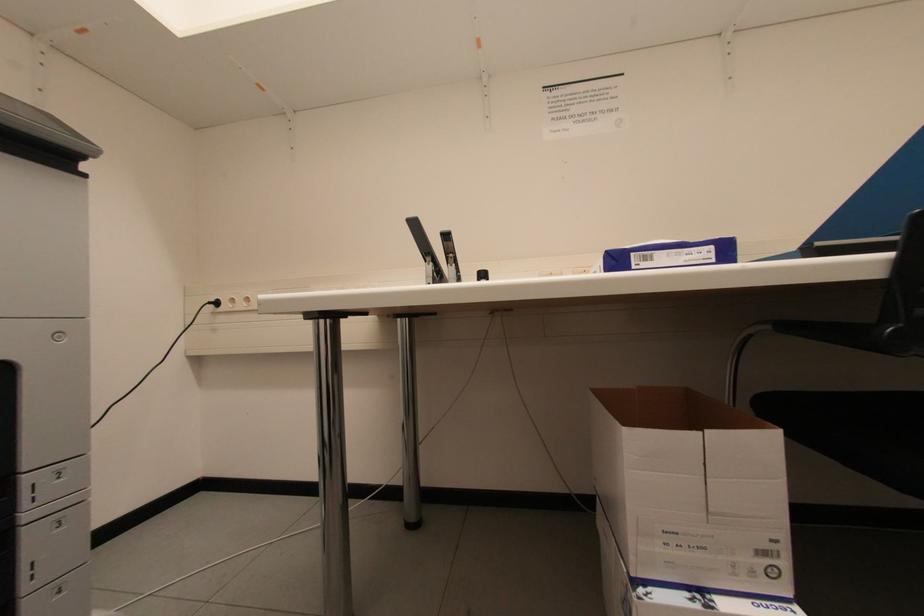
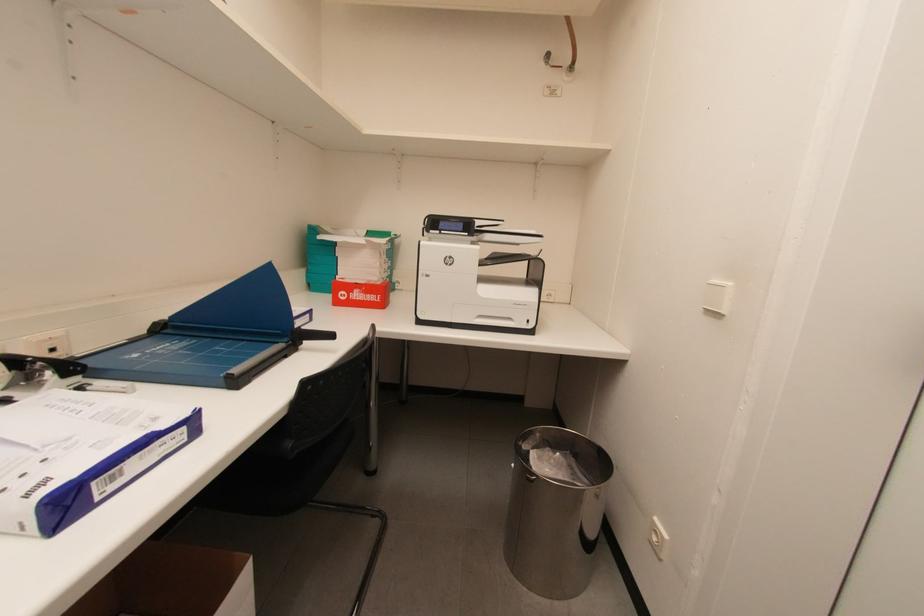
Question: The first image is from the beginning of the video and the second image is from the end. How did the camera likely rotate when shooting the video?

Choices:
 (A) Left
 (B) Right
 (C) Up
 (D) Down

Answer: (B)